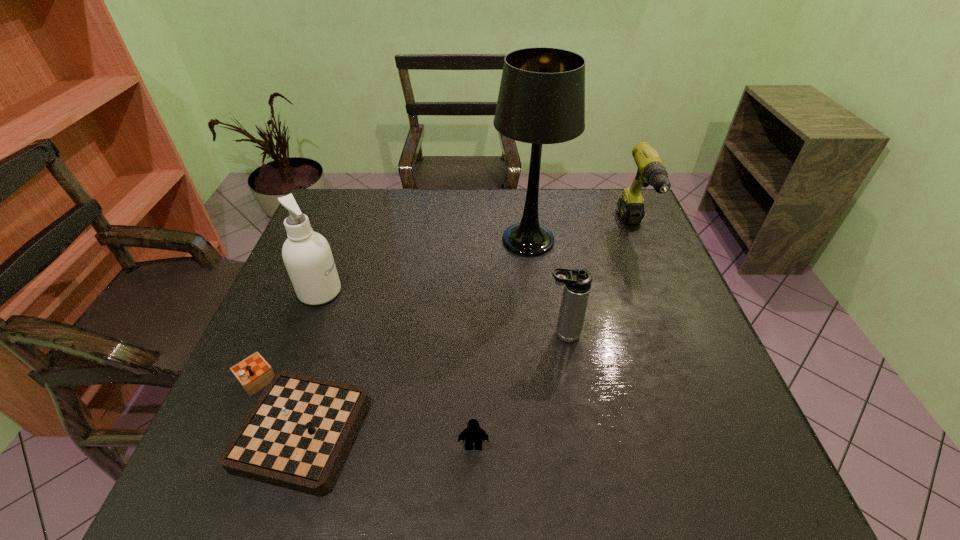
Locate an element on the screen. This screenshot has width=960, height=540. free space that is in between the chessboard and the rightmost object is located at coordinates (463, 326).

The width and height of the screenshot is (960, 540). In order to click on blank region between the chessboard and the third nearest object in this screenshot , I will do `click(426, 378)`.

I want to click on object that is the second closest one to the fifth tallest object, so click(577, 281).

Where is `the closest object to the third tallest object`? The image size is (960, 540). the closest object to the third tallest object is located at coordinates (541, 100).

Where is `free point that satisfies the following two spatial constraints: 1. on the front label of the shortest object; 2. on the left side of the fourth nearest object`? The width and height of the screenshot is (960, 540). free point that satisfies the following two spatial constraints: 1. on the front label of the shortest object; 2. on the left side of the fourth nearest object is located at coordinates click(272, 422).

This screenshot has width=960, height=540. What are the coordinates of `free spot that satisfies the following two spatial constraints: 1. on the handle side of the thermos bottle; 2. on the face of the Lego` in the screenshot? It's located at (582, 446).

Find the location of a particular element. This screenshot has height=540, width=960. free space that satisfies the following two spatial constraints: 1. on the handle side of the fourth shortest object; 2. on the handle side of the third nearest object is located at coordinates pyautogui.click(x=679, y=334).

The height and width of the screenshot is (540, 960). What are the coordinates of `vacant space that satisfies the following two spatial constraints: 1. on the front label of the third farthest object; 2. on the left side of the chessboard` in the screenshot? It's located at [x=272, y=422].